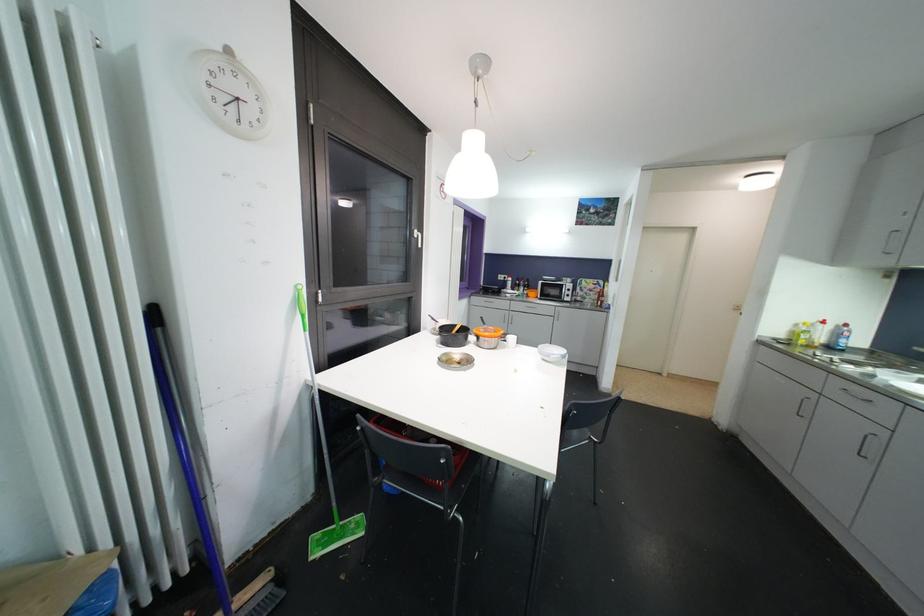
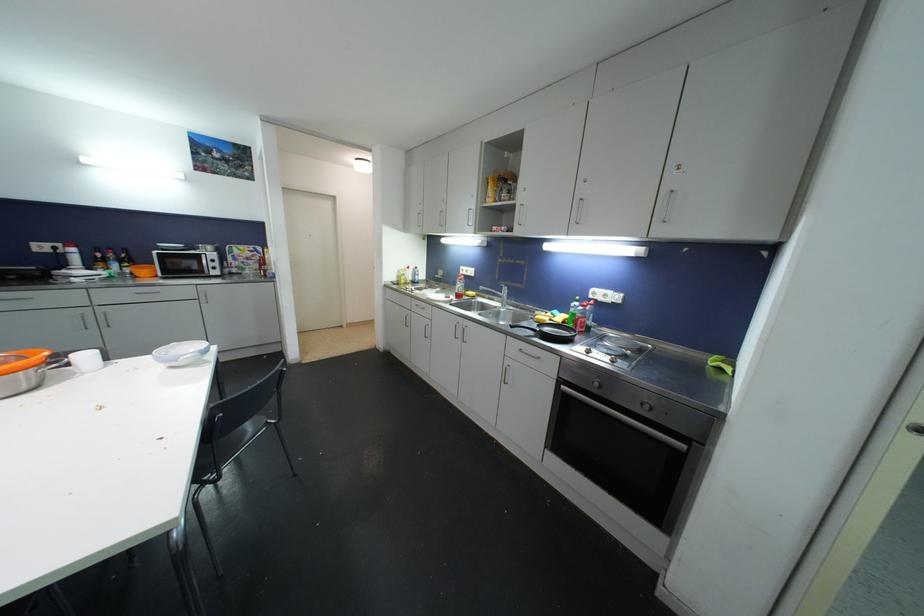
In the second image, find the point that corresponds to [497,334] in the first image.

(25, 361)